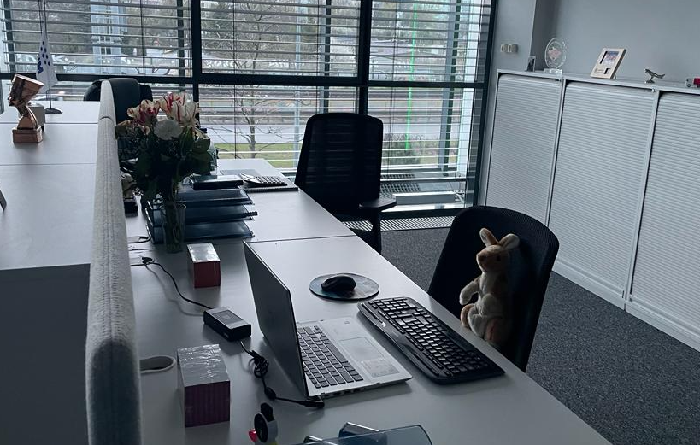
Where is `1 computer cord`? The width and height of the screenshot is (700, 445). 1 computer cord is located at coordinates (228, 311).